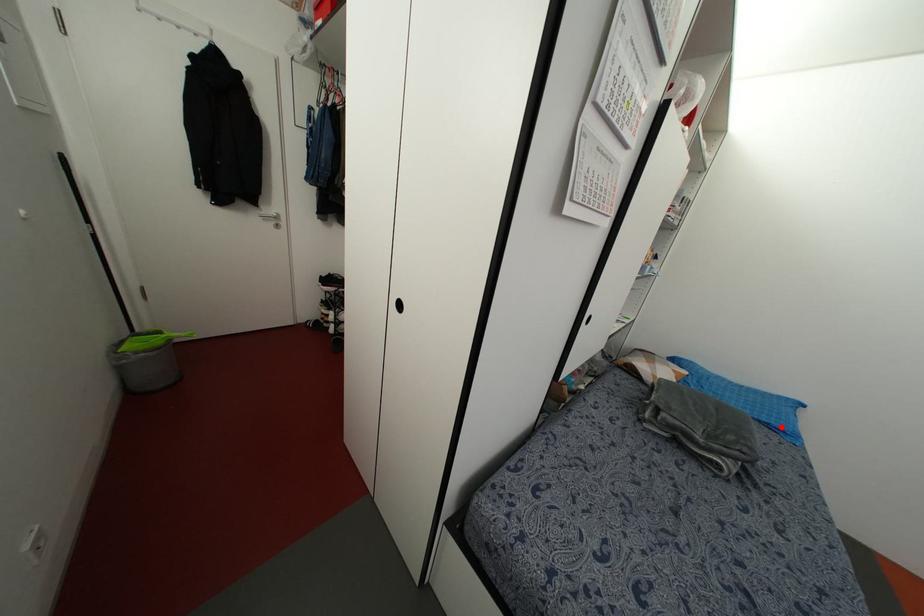
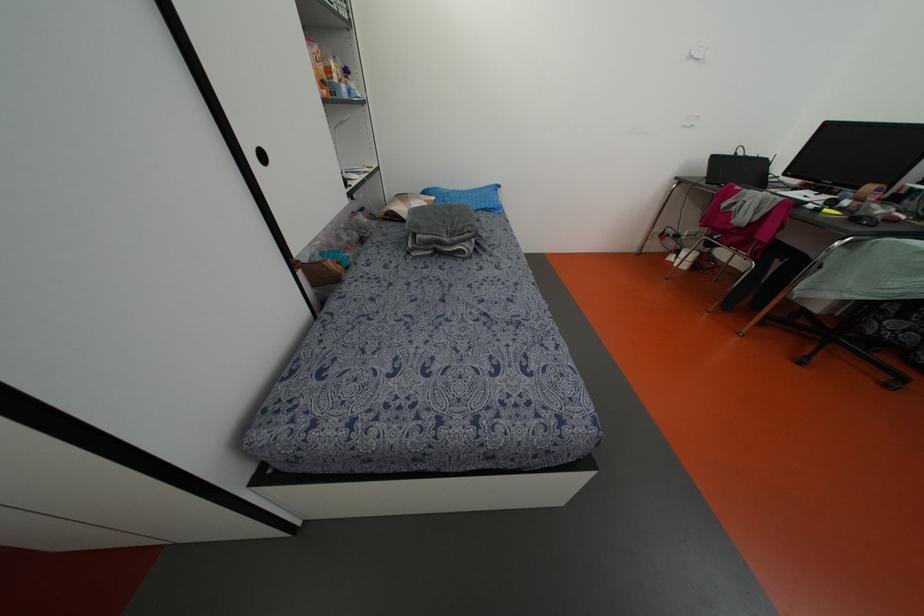
Locate, in the second image, the point that corresponds to the highlighted location in the first image.

(492, 206)